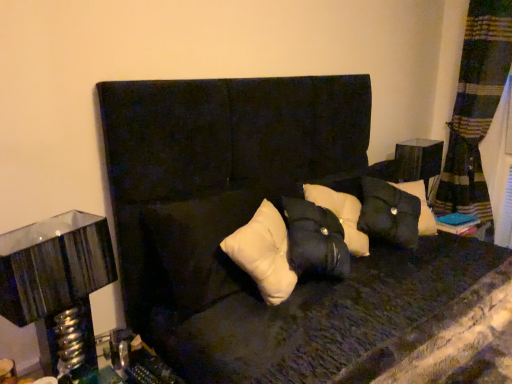
Question: Can you confirm if metallic silver table lamp at left is wider than matte black side table at right?

Choices:
 (A) no
 (B) yes

Answer: (B)

Question: From the image's perspective, is metallic silver table lamp at left located beneath matte black side table at right?

Choices:
 (A) yes
 (B) no

Answer: (A)

Question: From a real-world perspective, is metallic silver table lamp at left located beneath matte black side table at right?

Choices:
 (A) yes
 (B) no

Answer: (B)

Question: Is metallic silver table lamp at left surrounding matte black side table at right?

Choices:
 (A) no
 (B) yes

Answer: (A)

Question: Would you say metallic silver table lamp at left is outside matte black side table at right?

Choices:
 (A) yes
 (B) no

Answer: (A)

Question: Is matte black side table at right in front of or behind white matte pillow at center in the image?

Choices:
 (A) behind
 (B) front

Answer: (A)

Question: Does point (412, 168) appear closer or farther from the camera than point (263, 264)?

Choices:
 (A) closer
 (B) farther

Answer: (B)

Question: From a real-world perspective, relative to white matte pillow at center, is matte black side table at right vertically above or below?

Choices:
 (A) below
 (B) above

Answer: (A)

Question: Considering the positions of matte black side table at right and white matte pillow at center in the image, is matte black side table at right taller or shorter than white matte pillow at center?

Choices:
 (A) tall
 (B) short

Answer: (A)

Question: From the image's perspective, relative to metallic silver table lamp at left, is matte black side table at right above or below?

Choices:
 (A) below
 (B) above

Answer: (B)

Question: In the image, is matte black side table at right on the left side or the right side of metallic silver table lamp at left?

Choices:
 (A) right
 (B) left

Answer: (A)

Question: Which is correct: matte black side table at right is inside metallic silver table lamp at left, or outside of it?

Choices:
 (A) outside
 (B) inside

Answer: (A)

Question: Considering their positions, is matte black side table at right located in front of or behind metallic silver table lamp at left?

Choices:
 (A) behind
 (B) front

Answer: (A)

Question: Is metallic silver table lamp at left inside the boundaries of white matte pillow at center, or outside?

Choices:
 (A) inside
 (B) outside

Answer: (B)

Question: From a real-world perspective, relative to white matte pillow at center, is metallic silver table lamp at left vertically above or below?

Choices:
 (A) below
 (B) above

Answer: (A)